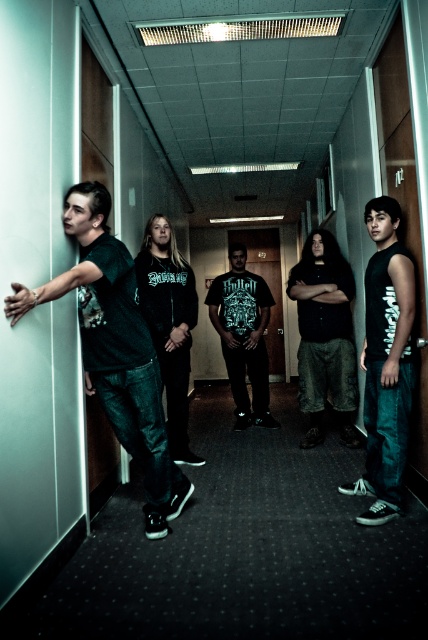
Question: In this image, where is dark green t-shirt at left located relative to black matte tank top at right?

Choices:
 (A) below
 (B) above

Answer: (A)

Question: Which point appears closest to the camera in this image?

Choices:
 (A) (386, 403)
 (B) (344, 310)
 (C) (246, 328)

Answer: (A)

Question: Is black matte tank top at right positioned behind dark green hoodie at center?

Choices:
 (A) no
 (B) yes

Answer: (A)

Question: Among these points, which one is farthest from the camera?

Choices:
 (A) (145, 472)
 (B) (321, 406)

Answer: (B)

Question: Estimate the real-world distances between objects in this image. Which object is closer to the dark green t-shirt at left?

Choices:
 (A) dark green hoodie at center
 (B) black matte t-shirt at center
 (C) dark green textured pants at center

Answer: (A)

Question: Is black matte tank top at right thinner than black matte t-shirt at center?

Choices:
 (A) no
 (B) yes

Answer: (B)